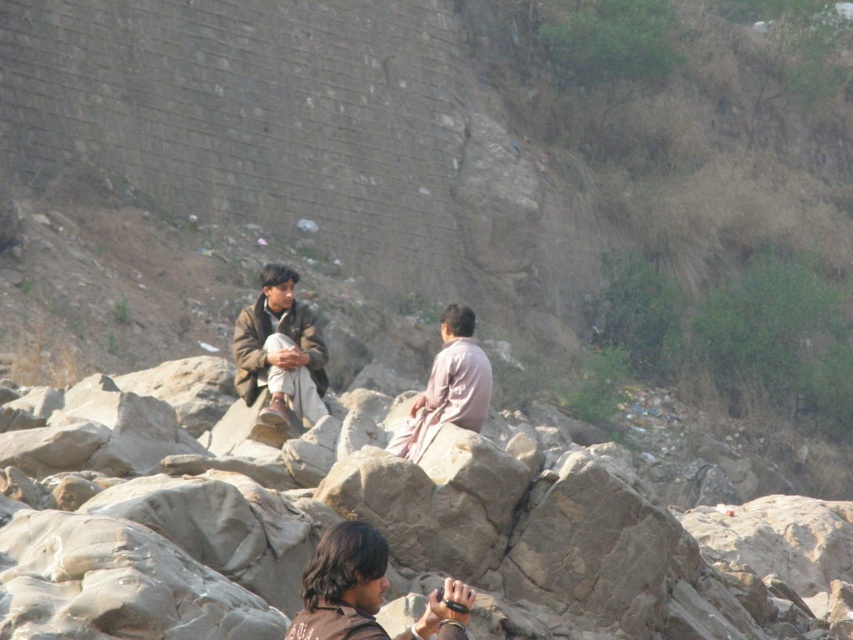
You are a photographer trying to capture a candid shot of both the brown leather jacket at center and the pale pink fabric at center. Since you want to ensure both are visible in the frame, which object should you focus on first to ensure depth of field?

The brown leather jacket at center is above the pale pink fabric at center. To ensure both are in focus, you should focus on the brown leather jacket at center first as it is closer to the camera.

You are standing at the edge of the riverbank and want to place your backpack between the smooth rock at center and the brown leather jacket at center. Based on their positions, which object should you place the backpack next to to ensure it is on the left side?

The backpack should be placed next to the brown leather jacket at center because it is on the left side of the smooth rock at center.